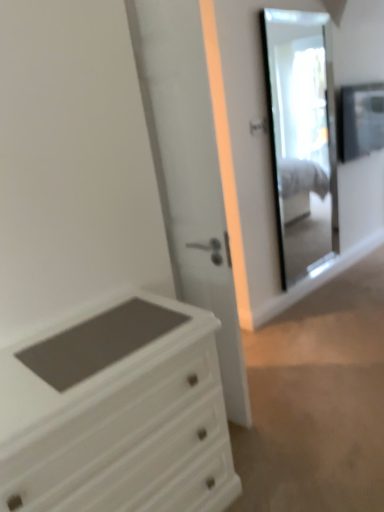
Where is `vacant region to the right of white glossy door at center`? This screenshot has height=512, width=384. vacant region to the right of white glossy door at center is located at coordinates (273, 397).